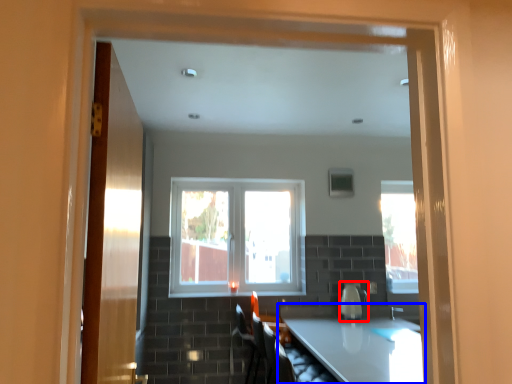
Question: Which point is closer to the camera, appliance (highlighted by a red box) or countertop (highlighted by a blue box)?

Choices:
 (A) appliance
 (B) countertop

Answer: (B)